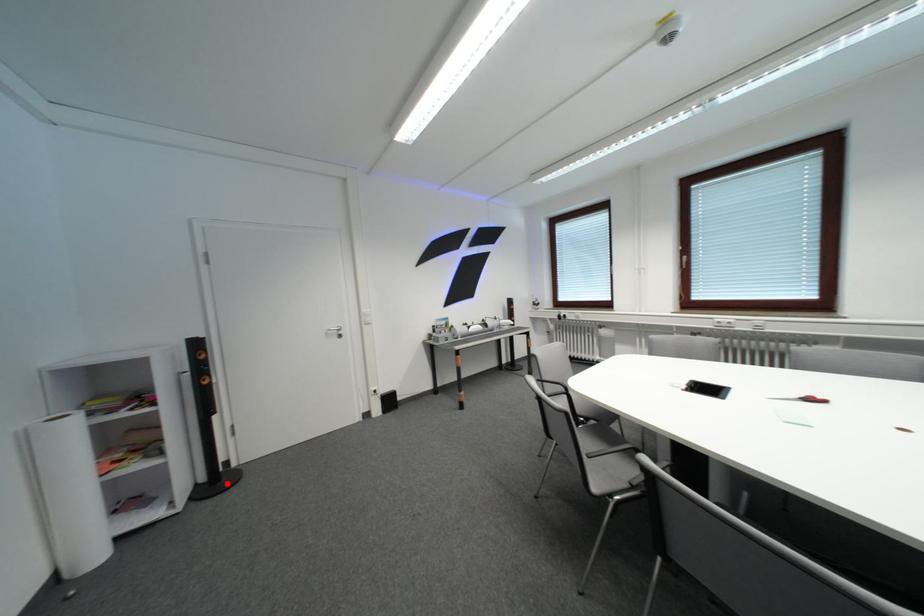
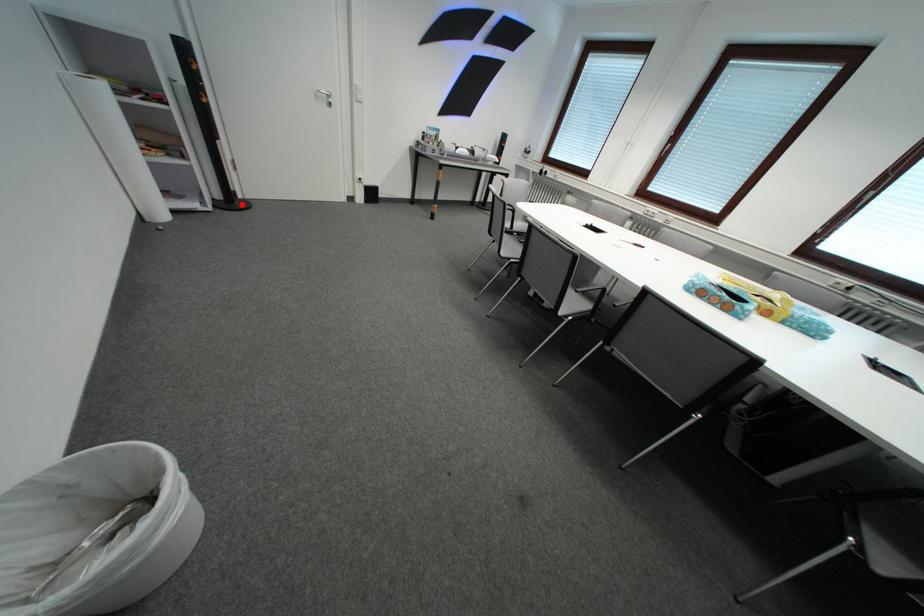
I am providing you with two images of the same scene from different viewpoints. A red point is marked on the first image and another point is marked on the second image. Does the point marked in image1 correspond to the same location as the one in image2?

Yes